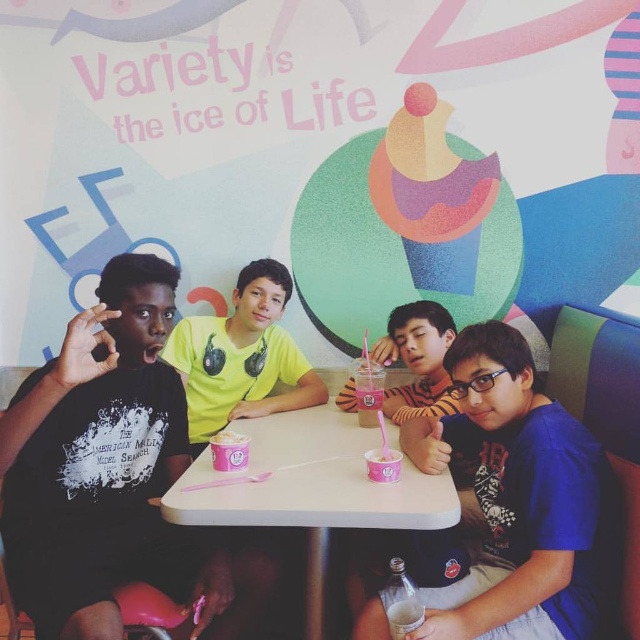
In the scene shown: Which of these two, blue matte shirt at center or translucent plastic cup at lower center, stands taller?

blue matte shirt at center is taller.

Which is more to the right, blue matte shirt at center or translucent plastic cup at lower center?

blue matte shirt at center is more to the right.

Which is behind, point (556, 625) or point (417, 604)?

The point (417, 604) is more distant.

Identify the location of blue matte shirt at center. (518, 500).

Consider the image. Who is taller, yellow matte shirt at center or translucent plastic cup at lower center?

With more height is yellow matte shirt at center.

What do you see at coordinates (241, 356) in the screenshot? I see `yellow matte shirt at center` at bounding box center [241, 356].

You are a GUI agent. You are given a task and a screenshot of the screen. Output one action in this format:
    pyautogui.click(x=<x>, y=<y>)
    Task: Click on the yellow matte shirt at center
    This screenshot has width=640, height=640.
    Given the screenshot: What is the action you would take?
    pyautogui.click(x=241, y=356)

Is blue matte shirt at center thinner than striped sweater at center?

No.

Identify the location of blue matte shirt at center. (518, 500).

Does point (611, 513) come farther from viewer compared to point (416, 308)?

No.

What are the coordinates of `blue matte shirt at center` in the screenshot? It's located at (518, 500).